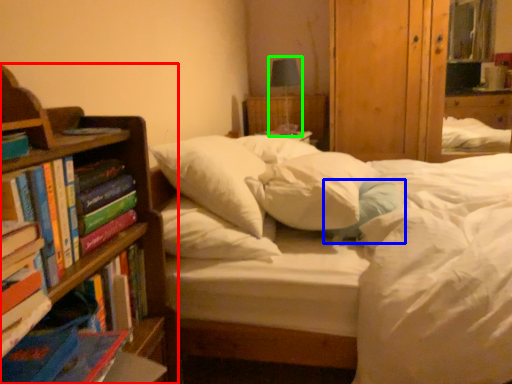
Question: Which object is positioned farthest from bookcase (highlighted by a red box)? Select from pillow (highlighted by a blue box) and table lamp (highlighted by a green box).

Choices:
 (A) pillow
 (B) table lamp

Answer: (B)